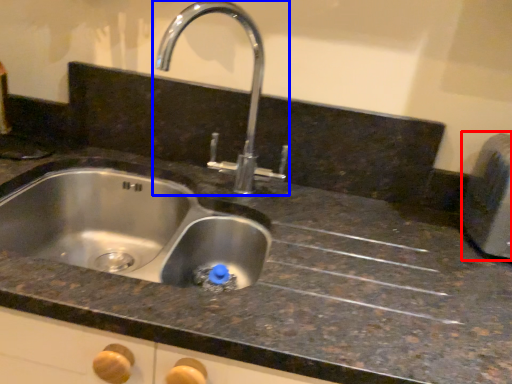
Question: Which point is closer to the camera, appliance (highlighted by a red box) or tap (highlighted by a blue box)?

Choices:
 (A) appliance
 (B) tap

Answer: (B)